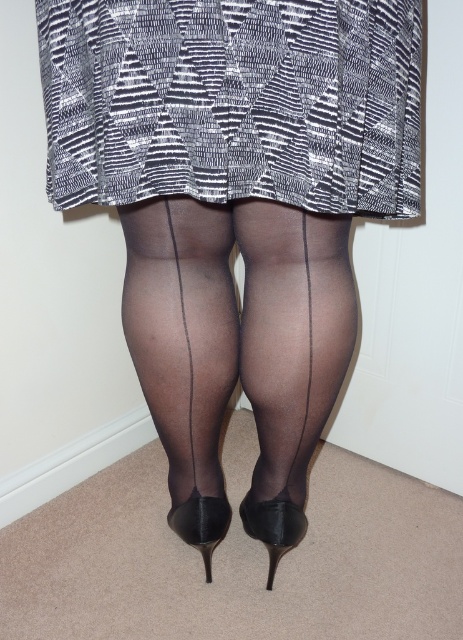
You are a fashion designer trying to decide which legwear to recommend for a client who wants something that reaches higher up on the legs. Looking at the image, which of the two items, the sheer black tights at center or the sheer black stockings at center, would you suggest?

The sheer black stockings at center are taller than the sheer black tights at center, so you should recommend the sheer black stockings at center for the client who wants legwear that reaches higher up on the legs.

Looking at this image, you are a fashion designer observing the image. You need to place a decorative pin exactly at the point marked as point (x=233, y=100). Which object from the scene should you place the pin on?

The point (x=233, y=100) is on the black textured skirt at center, so you should place the decorative pin on the black textured skirt at center.